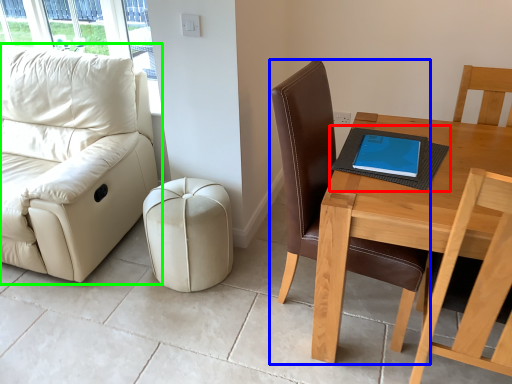
Question: Which object is the farthest from notebook (highlighted by a red box)? Choose among these: chair (highlighted by a blue box) or studio couch (highlighted by a green box).

Choices:
 (A) chair
 (B) studio couch

Answer: (B)